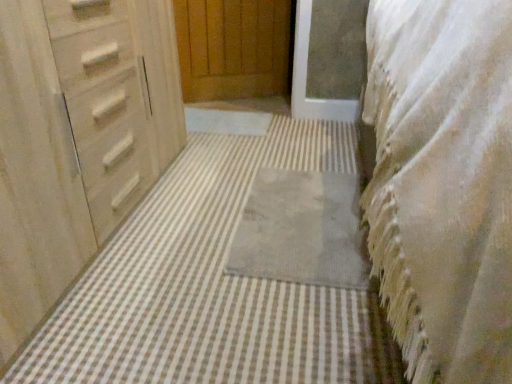
Question: Do you think matte wood chest of drawers at left is within gray soft rug at center, positioned as the 1th bath mat in back-to-front order, or outside of it?

Choices:
 (A) outside
 (B) inside

Answer: (A)

Question: Is matte wood chest of drawers at left to the left or to the right of gray soft rug at center, positioned as the 1th bath mat in back-to-front order, in the image?

Choices:
 (A) left
 (B) right

Answer: (A)

Question: Considering the real-world distances, which object is farthest from the matte wood chest of drawers at left?

Choices:
 (A) gray soft rug at center, which is the 1th bath mat in front-to-back order
 (B) white textured blanket at right
 (C) gray soft rug at center, the second bath mat when ordered from front to back

Answer: (B)

Question: Which of these objects is positioned closest to the matte wood chest of drawers at left?

Choices:
 (A) white textured blanket at right
 (B) gray soft rug at center, positioned as the 1th bath mat in back-to-front order
 (C) gray soft rug at center, the 2th bath mat when ordered from back to front

Answer: (C)